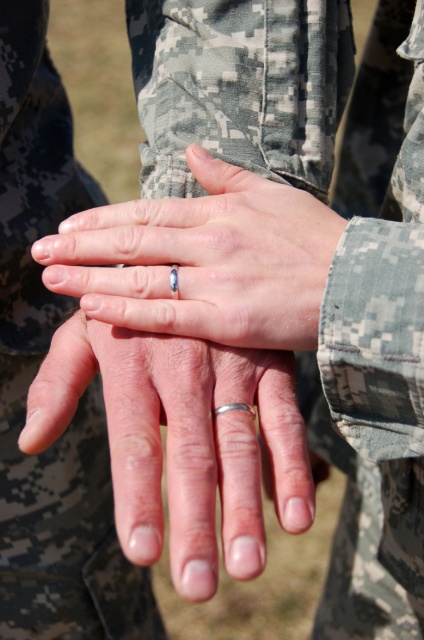
Question: Estimate the real-world distances between objects in this image. Which object is closer to the satin silver ring at center?

Choices:
 (A) digital camouflage fabric at center
 (B) silver metallic ring at center
 (C) digital camouflage uniform at center

Answer: (B)

Question: From the image, what is the correct spatial relationship of digital camouflage fabric at center in relation to satin silver ring at center?

Choices:
 (A) left
 (B) right

Answer: (B)

Question: Which object is closer to the camera taking this photo?

Choices:
 (A) digital camouflage uniform at center
 (B) digital camouflage fabric at center

Answer: (B)

Question: Does silver metallic ring at center have a smaller size compared to satin silver ring at center?

Choices:
 (A) yes
 (B) no

Answer: (B)

Question: Which point is closer to the camera?

Choices:
 (A) (214, 508)
 (B) (167, 320)

Answer: (A)

Question: Does digital camouflage fabric at center have a smaller size compared to satin silver ring at center?

Choices:
 (A) yes
 (B) no

Answer: (B)